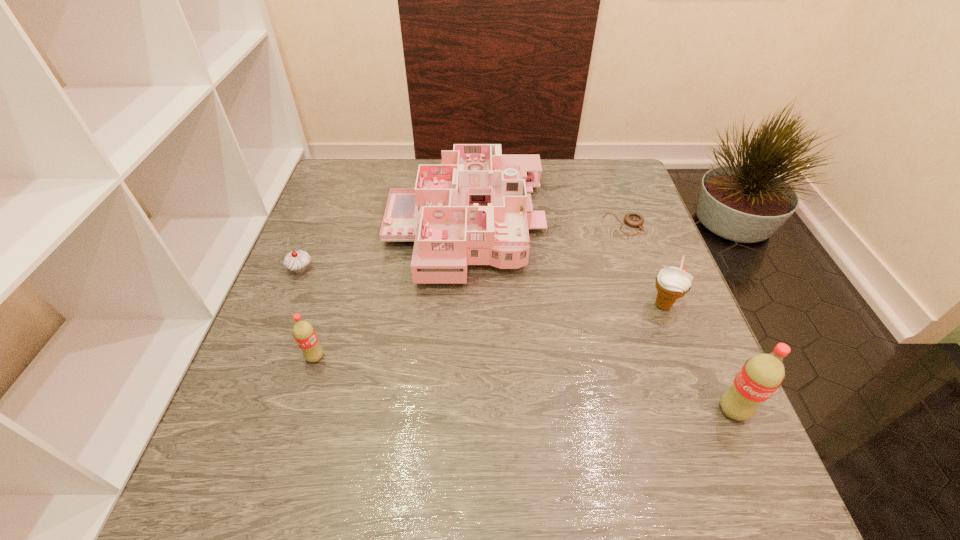
Locate an element on the screen. Image resolution: width=960 pixels, height=540 pixels. vacant region between the dollhouse and the icecream is located at coordinates click(x=564, y=266).

I want to click on blank region between the second nearest object and the second shortest object, so click(x=308, y=314).

I want to click on vacant area that lies between the shortest object and the fourth farthest object, so click(x=643, y=265).

Where is `empty location between the left soda and the pocket watch`? The width and height of the screenshot is (960, 540). empty location between the left soda and the pocket watch is located at coordinates (469, 291).

At what (x,y) coordinates should I click in order to perform the action: click on vacant area that lies between the shortest object and the farther soda. Please return your answer as a coordinate pair (x, y). The image size is (960, 540). Looking at the image, I should click on (469, 291).

I want to click on empty location between the leftmost object and the taller soda, so click(516, 340).

The height and width of the screenshot is (540, 960). I want to click on free area in between the shorter soda and the fourth farthest object, so click(489, 331).

Locate an element on the screen. unoccupied area between the fourth object from right to left and the nearer soda is located at coordinates (599, 318).

I want to click on object identified as the fourth closest to the fourth object from right to left, so click(x=672, y=283).

Select which object appears as the closest to the pocket watch. Please provide its 2D coordinates. Your answer should be formatted as a tuple, i.e. [(x, y)], where the tuple contains the x and y coordinates of a point satisfying the conditions above.

[(473, 209)]